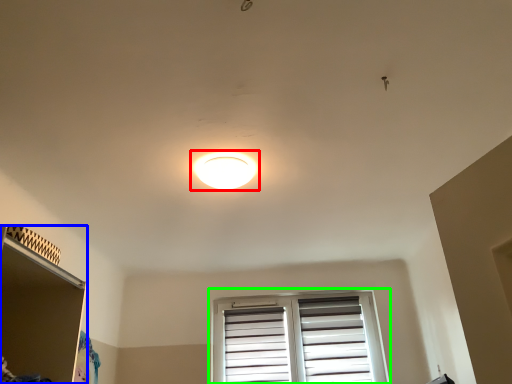
Question: Considering the real-world distances, which object is farthest from lamp (highlighted by a red box)? shelf (highlighted by a blue box) or window (highlighted by a green box)?

Choices:
 (A) shelf
 (B) window

Answer: (B)